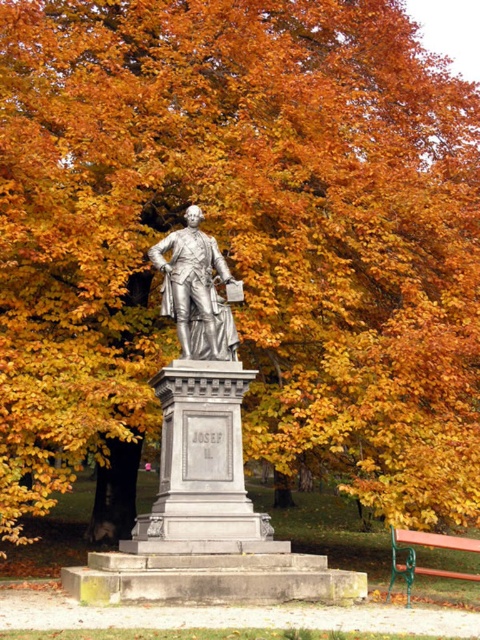
Which of these two, polished silver statue at center or wooden park bench at lower right, stands taller?

wooden park bench at lower right is taller.

How much distance is there between polished silver statue at center and wooden park bench at lower right?

They are 14.46 meters apart.

The height and width of the screenshot is (640, 480). What are the coordinates of `polished silver statue at center` in the screenshot? It's located at (195, 291).

This screenshot has height=640, width=480. Find the location of `polished silver statue at center`. polished silver statue at center is located at coordinates pyautogui.click(x=195, y=291).

Is polished bronze statue at center to the right of wooden park bench at lower right from the viewer's perspective?

No, polished bronze statue at center is not to the right of wooden park bench at lower right.

Can you confirm if polished bronze statue at center is taller than wooden park bench at lower right?

Indeed, polished bronze statue at center has a greater height compared to wooden park bench at lower right.

Between point (171, 477) and point (420, 536), which one is positioned behind?

The point (171, 477) is more distant.

The width and height of the screenshot is (480, 640). Find the location of `polished bronze statue at center`. polished bronze statue at center is located at coordinates (200, 422).

Between polished bronze statue at center and polished silver statue at center, which one appears on the right side from the viewer's perspective?

polished silver statue at center

Which is more to the left, polished bronze statue at center or polished silver statue at center?

Positioned to the left is polished bronze statue at center.

Between point (201, 506) and point (172, 294), which one is positioned behind?

The point (172, 294) is more distant.

This screenshot has width=480, height=640. Identify the location of polished bronze statue at center. (200, 422).